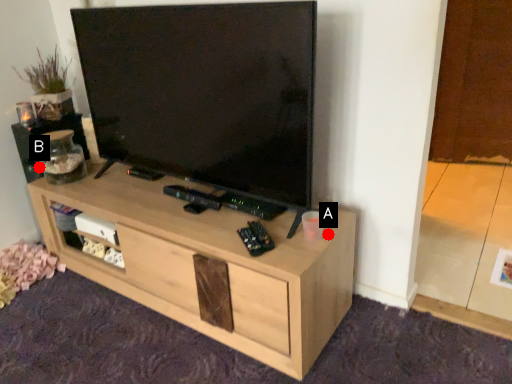
Question: Two points are circled on the image, labeled by A and B beside each circle. Which point is farther from the camera taking this photo?

Choices:
 (A) A is further
 (B) B is further

Answer: (B)